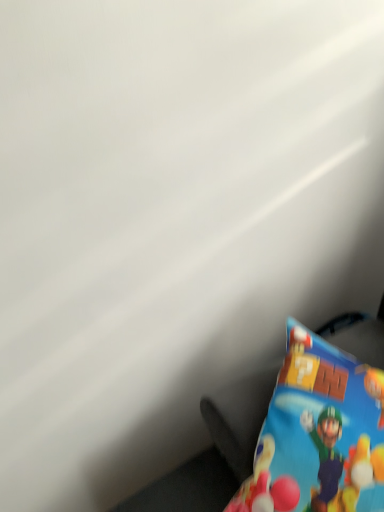
Describe the element at coordinates (319, 434) in the screenshot. I see `blue fabric pillow at lower right` at that location.

At what (x,y) coordinates should I click in order to perform the action: click on blue fabric pillow at lower right. Please return your answer as a coordinate pair (x, y). Image resolution: width=384 pixels, height=512 pixels. Looking at the image, I should click on (319, 434).

What is the approximate width of blue fabric pillow at lower right?

The width of blue fabric pillow at lower right is 46.46 centimeters.

I want to click on blue fabric pillow at lower right, so click(x=319, y=434).